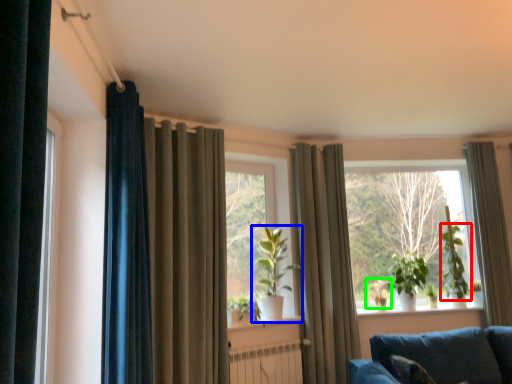
Question: Considering the real-world distances, which object is farthest from plant (highlighted by a red box)? houseplant (highlighted by a blue box) or plant (highlighted by a green box)?

Choices:
 (A) houseplant
 (B) plant

Answer: (A)